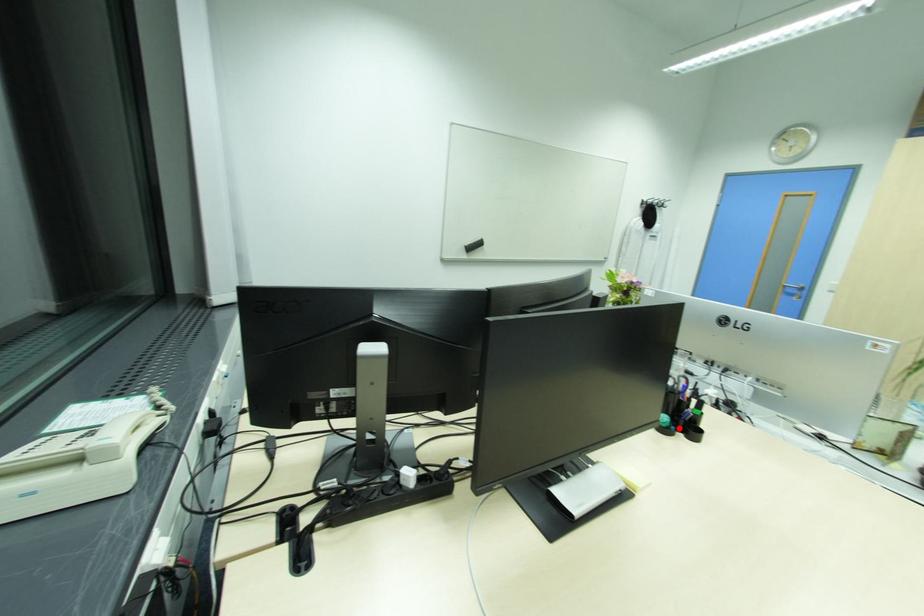
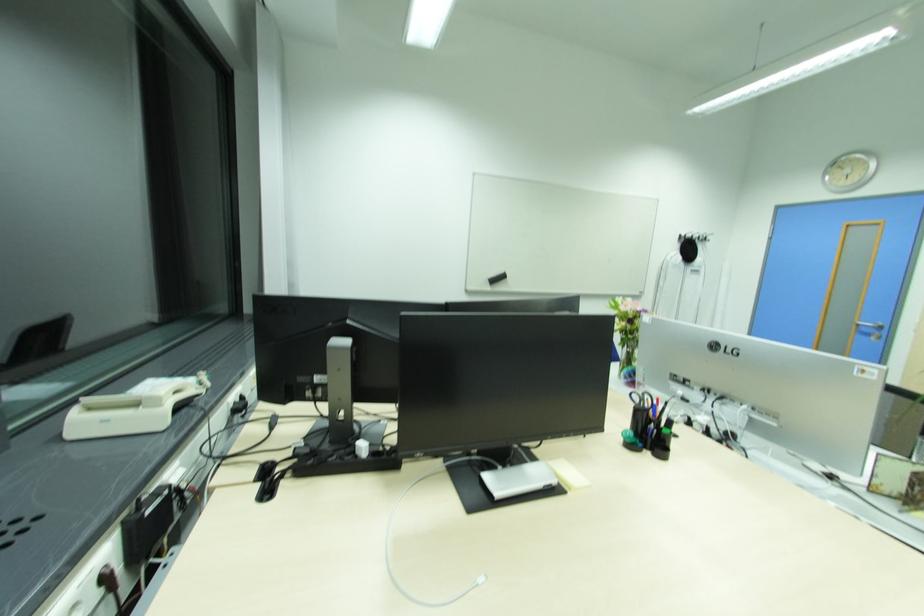
Locate, in the second image, the point that corresponds to the highlighted location in the first image.

(647, 446)